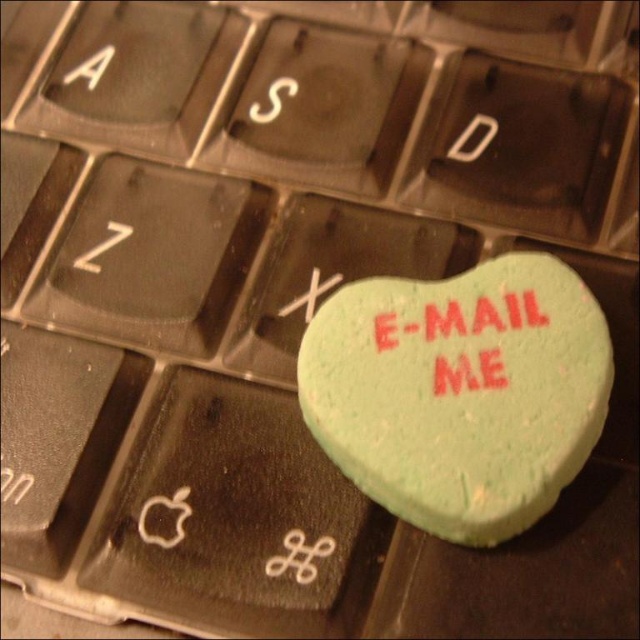
Does green matte heart at center appear on the right side of red rubber heart at center?

Incorrect, green matte heart at center is not on the right side of red rubber heart at center.

Does green matte heart at center lie in front of red rubber heart at center?

Yes, green matte heart at center is in front of red rubber heart at center.

In order to click on green matte heart at center in this screenshot , I will do 460,392.